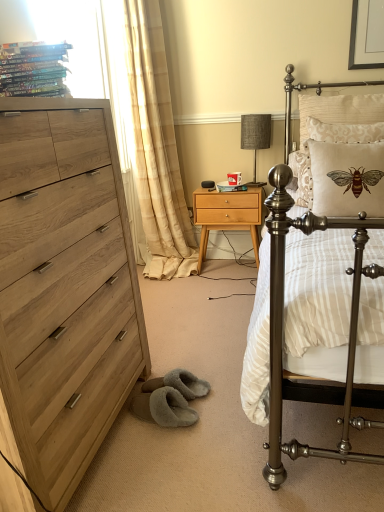
Question: From the image's perspective, relative to light wood/texture nightstand at center, is textured fabric lampshade at upper center above or below?

Choices:
 (A) above
 (B) below

Answer: (A)

Question: Is point (248, 121) positioned closer to the camera than point (226, 226)?

Choices:
 (A) closer
 (B) farther

Answer: (A)

Question: Estimate the real-world distances between objects in this image. Which object is closer to the beige sheer curtain at left?

Choices:
 (A) beige fabric pillow with embroidered bee at upper right, the third pillow in the back-to-front sequence
 (B) matte white magazine at center, marked as the 2th magazine in a left-to-right arrangement
 (C) textured fabric lampshade at upper center
 (D) beige textured pillow with bee design at upper right, positioned as the 3th pillow in front-to-back order
 (E) metallic bed at right

Answer: (B)

Question: Estimate the real-world distances between objects in this image. Which object is farther from the beige textured pillow with bee design at upper right, positioned as the 3th pillow in front-to-back order?

Choices:
 (A) beige sheer curtain at left
 (B) matte white magazine at center, marked as the 2th magazine in a left-to-right arrangement
 (C) light wood/texture nightstand at center
 (D) gray fuzzy slippers at lower center
 (E) hardcover books at upper left, the first magazine when ordered from left to right

Answer: (D)